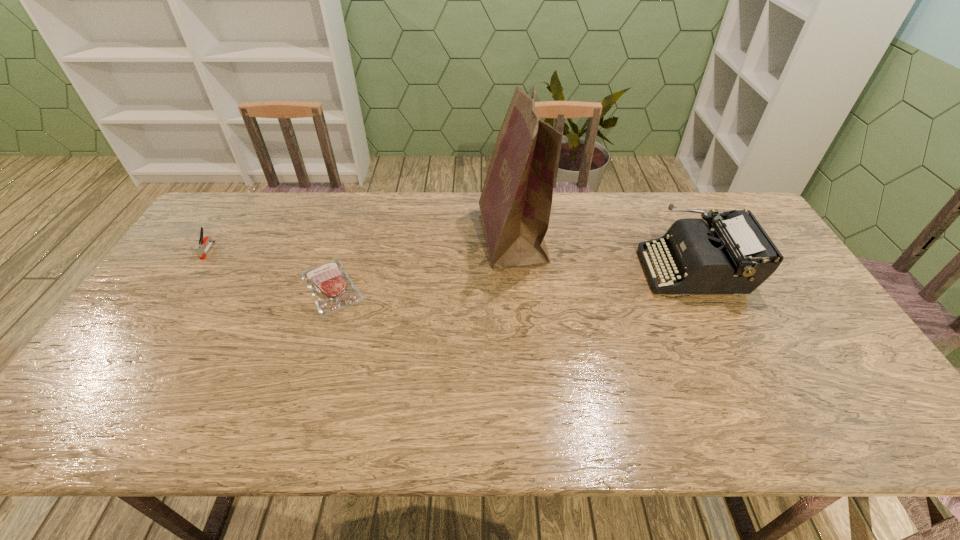
The width and height of the screenshot is (960, 540). I want to click on empty space between the leftmost object and the third shortest object, so click(451, 260).

What are the coordinates of `unoccupied area between the typewriter and the stapler` in the screenshot? It's located at (451, 260).

I want to click on vacant point located between the steak and the rightmost object, so click(x=513, y=278).

Locate an element on the screen. This screenshot has width=960, height=540. object identified as the third closest to the third shortest object is located at coordinates (199, 249).

Identify which object is located as the third nearest to the rightmost object. Please provide its 2D coordinates. Your answer should be formatted as a tuple, i.e. [(x, y)], where the tuple contains the x and y coordinates of a point satisfying the conditions above.

[(199, 249)]

The width and height of the screenshot is (960, 540). What are the coordinates of `vacant space that satisfies the following two spatial constraints: 1. on the handle side of the leftmost object; 2. on the right side of the shortest object` in the screenshot? It's located at (184, 287).

I want to click on vacant point that satisfies the following two spatial constraints: 1. on the front-facing side of the grocery bag; 2. on the handle side of the stapler, so click(514, 250).

Image resolution: width=960 pixels, height=540 pixels. In order to click on free space that satisfies the following two spatial constraints: 1. on the front-facing side of the tallest object; 2. on the front side of the steak in this screenshot , I will do `click(516, 287)`.